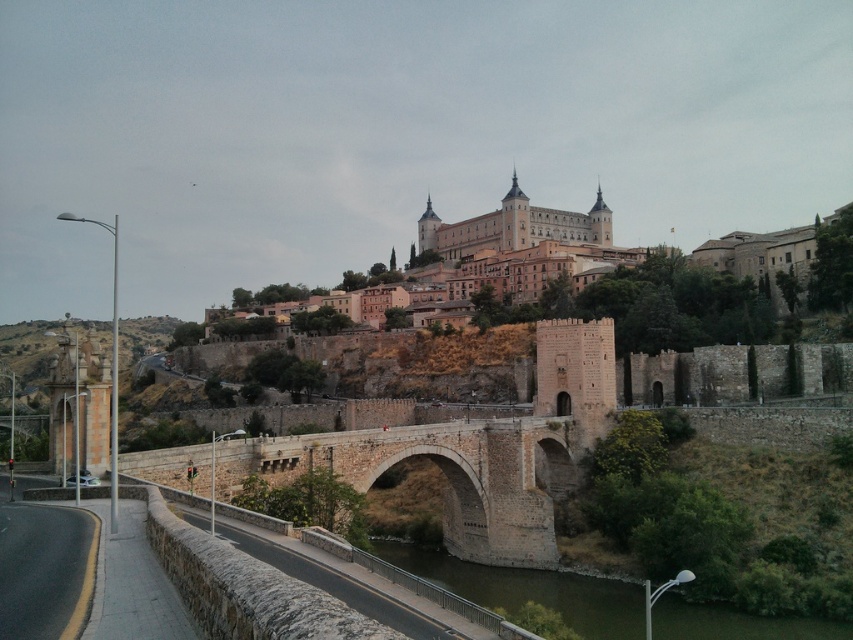
Is the position of greenish-brown water at lower center more distant than that of brown stone castle at center?

No, greenish-brown water at lower center is in front of brown stone castle at center.

Does point (706, 604) come behind point (509, 241)?

No, it is not.

Between point (438, 580) and point (514, 212), which one is positioned behind?

Point (514, 212)

You are a GUI agent. You are given a task and a screenshot of the screen. Output one action in this format:
    pyautogui.click(x=<x>, y=<y>)
    Task: Click on the greenish-brown water at lower center
    The height and width of the screenshot is (640, 853).
    Given the screenshot: What is the action you would take?
    pyautogui.click(x=529, y=589)

Who is more forward, (790, 237) or (430, 211)?

Point (790, 237) is in front.

Which is in front, point (730, 296) or point (479, 228)?

Point (730, 296) is in front.

Locate an element on the screen. Image resolution: width=853 pixels, height=640 pixels. stone castle at center is located at coordinates (656, 278).

Does stone castle at center have a larger size compared to greenish-brown water at lower center?

Yes.

Which is in front, point (775, 285) or point (670, 612)?

Positioned in front is point (670, 612).

The image size is (853, 640). Find the location of `stone castle at center`. stone castle at center is located at coordinates (656, 278).